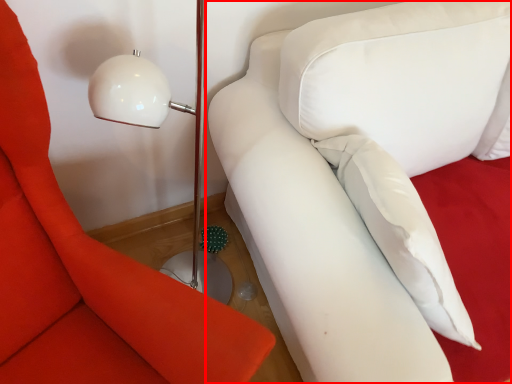
Question: From the image's perspective, where is studio couch (annotated by the red box) located in relation to furniture in the image?

Choices:
 (A) above
 (B) below

Answer: (A)